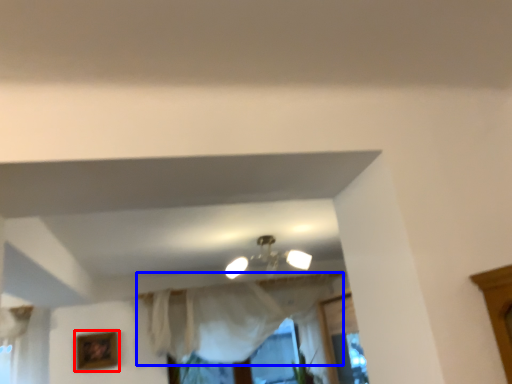
Question: Which object is closer to the camera taking this photo, picture frame (highlighted by a red box) or curtain (highlighted by a blue box)?

Choices:
 (A) picture frame
 (B) curtain

Answer: (B)